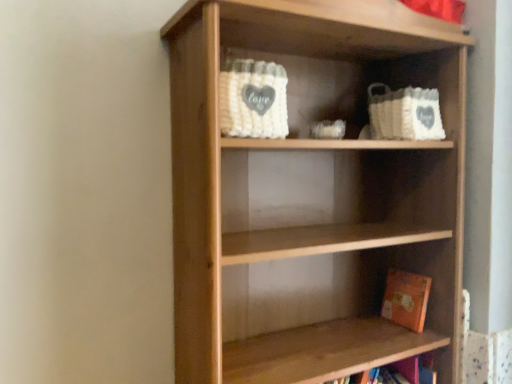
Question: Can you confirm if natural wood shelf at center is positioned to the left of orange matte book at lower right?

Choices:
 (A) no
 (B) yes

Answer: (B)

Question: Is natural wood shelf at center positioned with its back to orange matte book at lower right?

Choices:
 (A) yes
 (B) no

Answer: (A)

Question: Is natural wood shelf at center positioned beyond the bounds of orange matte book at lower right?

Choices:
 (A) yes
 (B) no

Answer: (A)

Question: Is natural wood shelf at center positioned in front of orange matte book at lower right?

Choices:
 (A) yes
 (B) no

Answer: (A)

Question: Are natural wood shelf at center and orange matte book at lower right located far from each other?

Choices:
 (A) yes
 (B) no

Answer: (B)

Question: Is natural wood shelf at center bigger than orange matte book at lower right?

Choices:
 (A) yes
 (B) no

Answer: (A)

Question: Are orange matte book at lower right and natural wood shelf at center located far from each other?

Choices:
 (A) no
 (B) yes

Answer: (A)

Question: From the image's perspective, is orange matte book at lower right over natural wood shelf at center?

Choices:
 (A) no
 (B) yes

Answer: (A)

Question: Is the depth of orange matte book at lower right less than that of natural wood shelf at center?

Choices:
 (A) no
 (B) yes

Answer: (A)

Question: Could you tell me if orange matte book at lower right is facing natural wood shelf at center?

Choices:
 (A) yes
 (B) no

Answer: (A)

Question: Are orange matte book at lower right and natural wood shelf at center beside each other?

Choices:
 (A) no
 (B) yes

Answer: (A)

Question: Considering the relative positions of orange matte book at lower right and natural wood shelf at center in the image provided, is orange matte book at lower right to the left of natural wood shelf at center from the viewer's perspective?

Choices:
 (A) yes
 (B) no

Answer: (B)

Question: Visually, is orange matte book at lower right positioned to the left or to the right of natural wood shelf at center?

Choices:
 (A) right
 (B) left

Answer: (A)